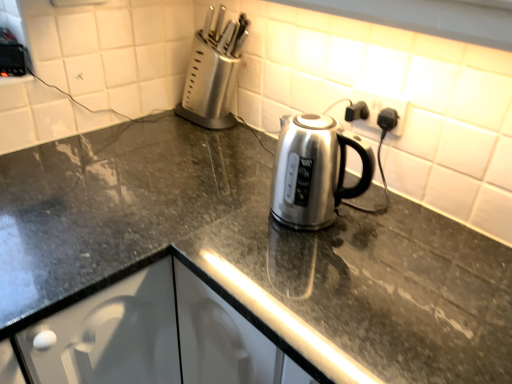
Question: From the image's perspective, relative to black plastic outlet at upper right, is satin silver knife block at upper left above or below?

Choices:
 (A) below
 (B) above

Answer: (B)

Question: From a real-world perspective, is satin silver knife block at upper left positioned above or below black plastic outlet at upper right?

Choices:
 (A) above
 (B) below

Answer: (B)

Question: Which object is the closest to the black plastic outlet at upper right?

Choices:
 (A) slate gray granite countertop at center
 (B) satin silver knife block at upper left

Answer: (B)

Question: Which object is the farthest from the slate gray granite countertop at center?

Choices:
 (A) satin silver knife block at upper left
 (B) black plastic outlet at upper right

Answer: (A)